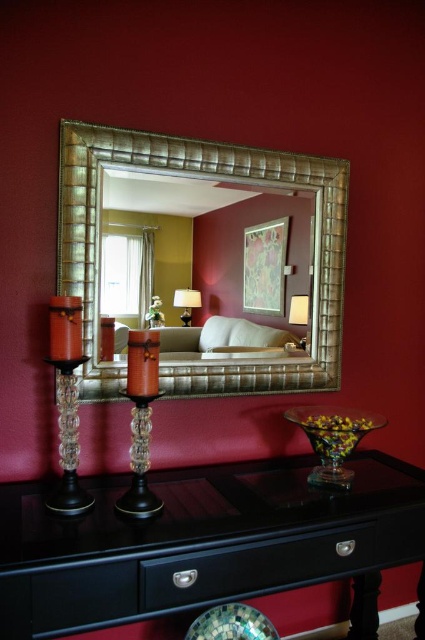
You are a delivery person who just arrived at this location. You need to place a package that is 30 inches long on the floor between the gold textured mirror at center and the black glossy drawer at lower center. Is there enough space for the package?

The distance between the gold textured mirror at center and the black glossy drawer at lower center is 27.86 inches. Since the package is 30 inches long, it is slightly longer than the available space. Therefore, the package will not fit between them.

You are an interior designer checking the proportions of the gold textured mirror at center and the black wood drawer at lower center. Which object is taller?

The gold textured mirror at center is taller than the black wood drawer at lower center.

You are arranging flowers for a centerpiece and need to place them between the gold textured mirror at center and the black glossy drawer at lower center. Based on their positions, which object should the flowers be closer to?

The gold textured mirror at center is positioned on the left side of the black glossy drawer at lower center, so the flowers should be placed closer to the gold textured mirror at center since it is to the left of the drawer.